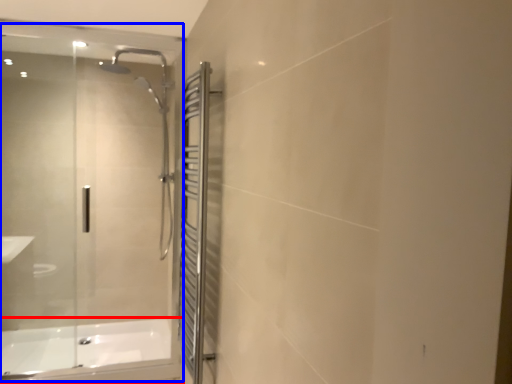
Question: Which of the following is the farthest to the observer, bathtub (highlighted by a red box) or glass door (highlighted by a blue box)?

Choices:
 (A) bathtub
 (B) glass door

Answer: (A)